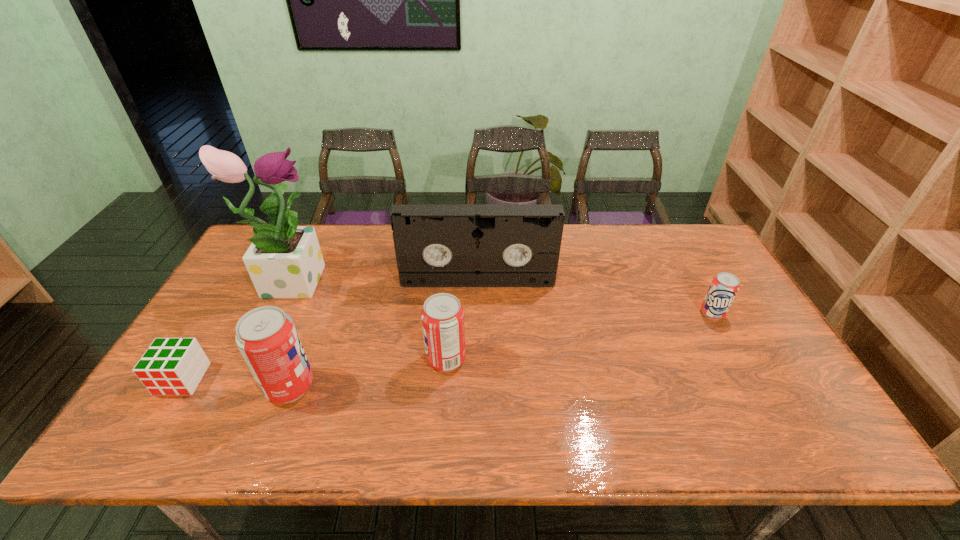
Locate an element on the screen. Image resolution: width=960 pixels, height=540 pixels. object that is at the near left corner is located at coordinates (170, 366).

Identify the location of vacant space at the far edge of the desktop. (653, 256).

Locate an element on the screen. The width and height of the screenshot is (960, 540). free region at the near edge of the desktop is located at coordinates (454, 408).

Where is `vacant space at the left edge of the desktop`? The width and height of the screenshot is (960, 540). vacant space at the left edge of the desktop is located at coordinates (222, 379).

The image size is (960, 540). Find the location of `vacant space at the right edge`. vacant space at the right edge is located at coordinates (785, 369).

The image size is (960, 540). I want to click on empty space between the leftmost soda can and the shortest object, so pos(236,383).

Locate an element on the screen. The width and height of the screenshot is (960, 540). free space between the leftmost soda can and the fourth tallest object is located at coordinates (368, 373).

The image size is (960, 540). Identify the location of empty location between the second tallest soda can and the leftmost soda can. (368, 373).

Locate an element on the screen. Image resolution: width=960 pixels, height=540 pixels. vacant space in between the videotape and the flower arrangement is located at coordinates (385, 279).

You are a GUI agent. You are given a task and a screenshot of the screen. Output one action in this format:
    pyautogui.click(x=<x>, y=<y>)
    Task: Click on the free space that is in between the cube and the leftmost soda can
    This screenshot has height=540, width=960.
    Given the screenshot: What is the action you would take?
    pyautogui.click(x=236, y=383)